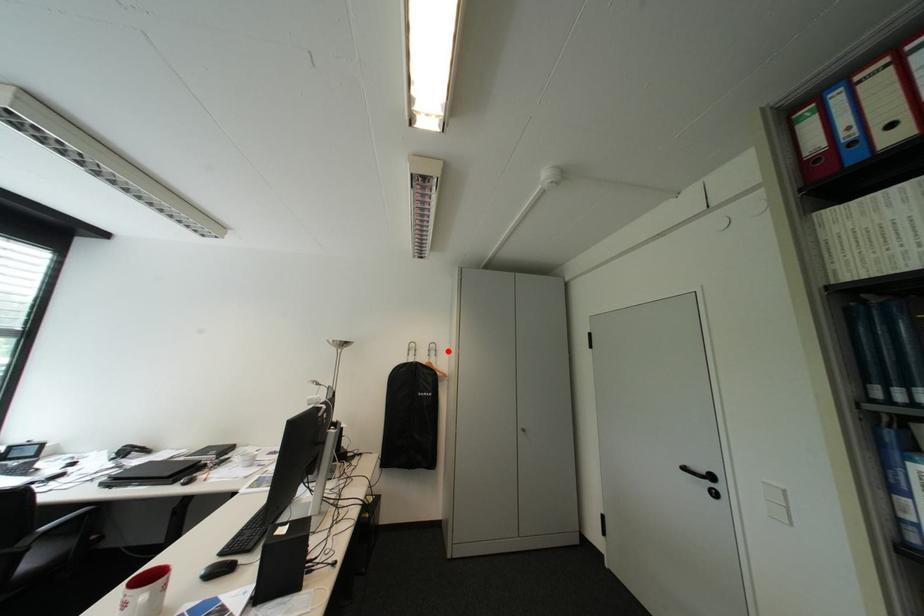
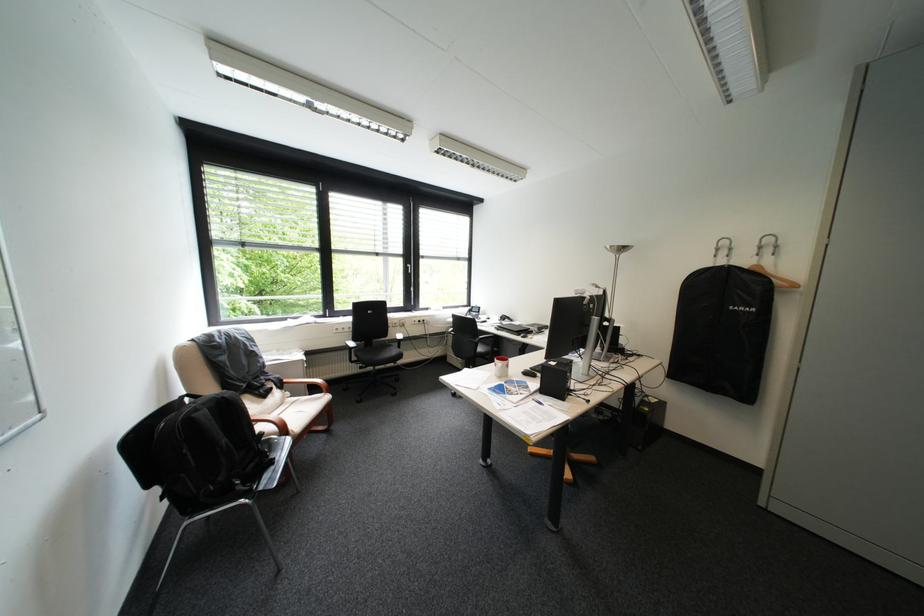
The point at the highlighted location is marked in the first image. Where is the corresponding point in the second image?

(788, 246)